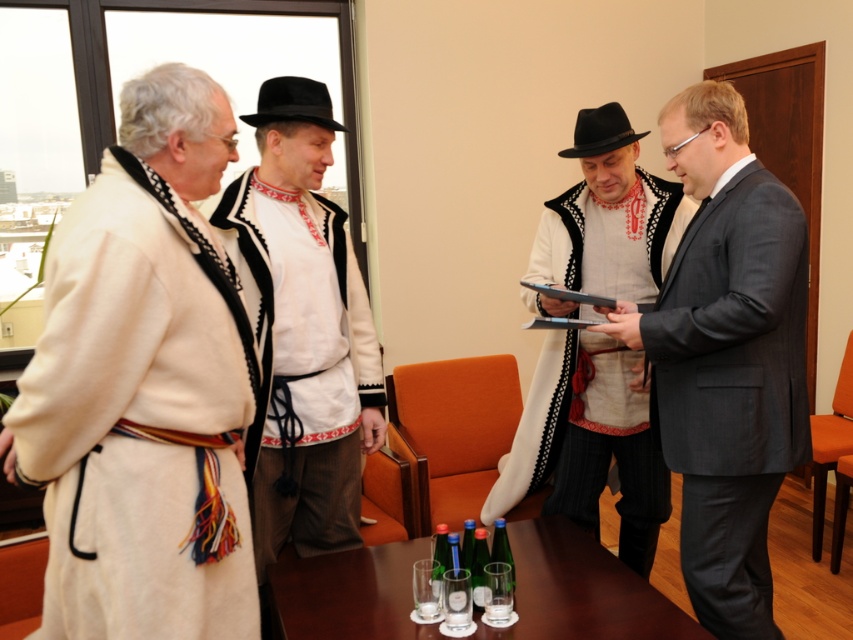
Looking at this image, is matte black suit at right above white embroidered shirt at center?

No, matte black suit at right is not above white embroidered shirt at center.

The width and height of the screenshot is (853, 640). I want to click on matte black suit at right, so click(x=726, y=356).

Where is `matte black suit at right`? This screenshot has width=853, height=640. matte black suit at right is located at coordinates (726, 356).

Between matte black vest at center and green glass bottles at center, which one appears on the left side from the viewer's perspective?

Positioned to the left is green glass bottles at center.

Is matte black vest at center bigger than green glass bottles at center?

Yes, matte black vest at center is bigger than green glass bottles at center.

Between point (552, 308) and point (611, 634), which one is positioned in front?

Point (611, 634)

I want to click on matte black vest at center, so click(x=589, y=442).

Does white woolen robe at left come in front of white embroidered shirt at center?

Yes, white woolen robe at left is closer to the viewer.

Can you confirm if white woolen robe at left is bigger than white embroidered shirt at center?

Correct, white woolen robe at left is larger in size than white embroidered shirt at center.

Locate an element on the screen. The width and height of the screenshot is (853, 640). white woolen robe at left is located at coordinates (143, 387).